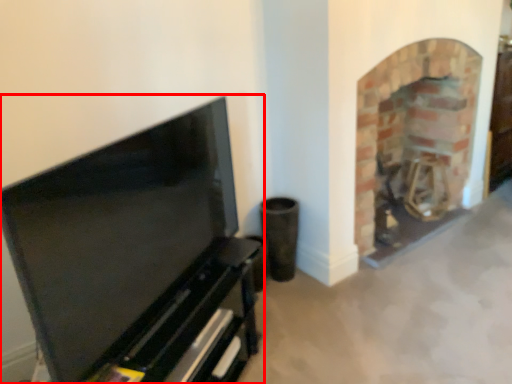
Question: In this image, where is entertainment center (annotated by the red box) located relative to fireplace?

Choices:
 (A) left
 (B) right

Answer: (A)